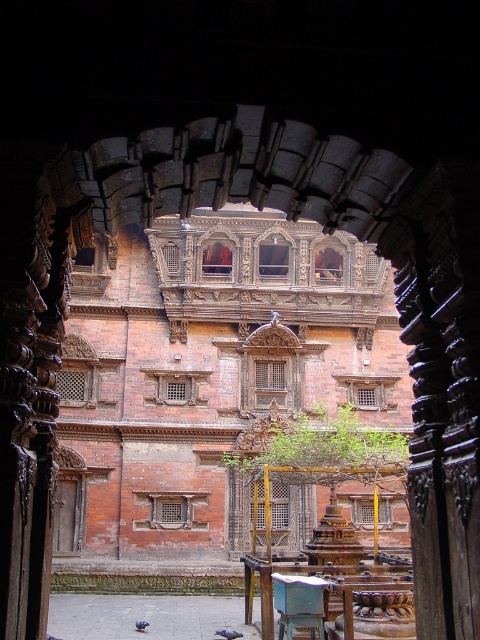
Can you confirm if gray feathered pigeon at center is bigger than blue feathered pigeon at center?

Yes.

Which of these two, gray feathered pigeon at center or blue feathered pigeon at center, stands shorter?

gray feathered pigeon at center is shorter.

Is point (217, 632) closer to camera compared to point (144, 628)?

No.

At what (x,y) coordinates should I click in order to perform the action: click on gray feathered pigeon at center. Please return your answer as a coordinate pair (x, y). The image size is (480, 640). Looking at the image, I should click on (228, 634).

Looking at this image, is wooden chair at center further to the viewer compared to blue feathered pigeon at center?

No, wooden chair at center is in front of blue feathered pigeon at center.

Can you confirm if wooden chair at center is positioned to the right of blue feathered pigeon at center?

Correct, you'll find wooden chair at center to the right of blue feathered pigeon at center.

Is point (286, 579) closer to viewer compared to point (144, 625)?

Yes.

Find the location of `wooden chair at center`. wooden chair at center is located at coordinates (299, 604).

Which is more to the left, wooden chair at center or gray feathered pigeon at center?

Positioned to the left is gray feathered pigeon at center.

Which is more to the right, wooden chair at center or gray feathered pigeon at center?

From the viewer's perspective, wooden chair at center appears more on the right side.

Measure the distance between point (276, 611) and camera.

They are 164.11 feet apart.

This screenshot has height=640, width=480. I want to click on wooden chair at center, so click(x=299, y=604).